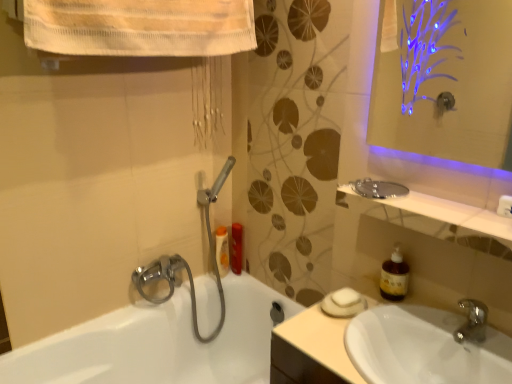
Question: Is clear glass mirror at upper right to the left or to the right of orange glossy lotion at upper left, placed as the first toiletry when sorted from left to right, in the image?

Choices:
 (A) right
 (B) left

Answer: (A)

Question: Based on their sizes in the image, would you say clear glass mirror at upper right is bigger or smaller than orange glossy lotion at upper left, the second toiletry when ordered from right to left?

Choices:
 (A) big
 (B) small

Answer: (A)

Question: Estimate the real-world distances between objects in this image. Which object is farther from the white matte soap at sink?

Choices:
 (A) matte plastic bottle at center, marked as the second toiletry in a left-to-right arrangement
 (B) white glossy sink at lower right
 (C) clear glass mirror at upper right
 (D) orange glossy lotion at upper left, the second toiletry when ordered from right to left
 (E) brown translucent soap dispenser at right

Answer: (D)

Question: Based on their relative distances, which object is farther from the clear glass mirror at upper right?

Choices:
 (A) brown translucent soap dispenser at right
 (B) orange glossy lotion at upper left, placed as the first toiletry when sorted from left to right
 (C) matte plastic bottle at center, the first toiletry when ordered from right to left
 (D) white matte soap at sink
 (E) white glossy bathtub at lower left

Answer: (B)